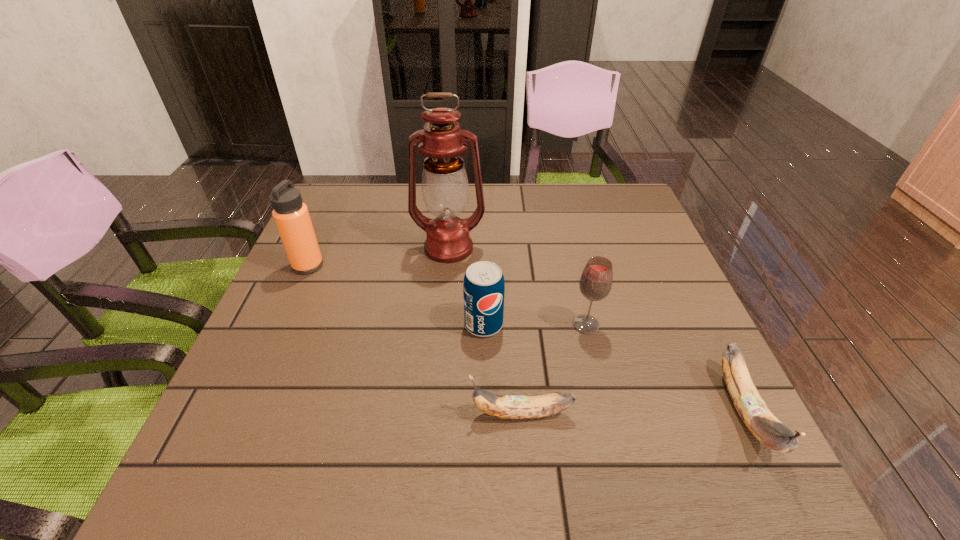
This screenshot has height=540, width=960. I want to click on vacant area that lies between the thermos bottle and the glass drink container, so click(447, 295).

Where is `blank region between the oil lamp and the leftmost object`? This screenshot has height=540, width=960. blank region between the oil lamp and the leftmost object is located at coordinates (378, 256).

This screenshot has height=540, width=960. What are the coordinates of `vacant area that lies between the glass drink container and the shorter banana` in the screenshot? It's located at (554, 369).

At what (x,y) coordinates should I click in order to perform the action: click on object that can be found as the closest to the oil lamp. Please return your answer as a coordinate pair (x, y). This screenshot has height=540, width=960. Looking at the image, I should click on (483, 288).

Locate an element on the screen. The width and height of the screenshot is (960, 540). the closest object to the glass drink container is located at coordinates (483, 288).

Locate an element on the screen. The image size is (960, 540). vacant area in the image that satisfies the following two spatial constraints: 1. on the front side of the oil lamp; 2. on the left side of the glass drink container is located at coordinates (443, 325).

Where is `free space that satisfies the following two spatial constraints: 1. on the front side of the third shortest object; 2. on the left side of the second object from right to left`? Image resolution: width=960 pixels, height=540 pixels. free space that satisfies the following two spatial constraints: 1. on the front side of the third shortest object; 2. on the left side of the second object from right to left is located at coordinates (484, 325).